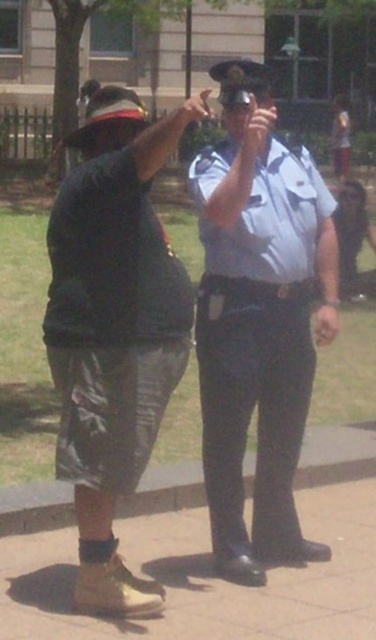
This screenshot has width=376, height=640. I want to click on matte black shirt at center, so click(x=113, y=328).

Can you confirm if matte black shirt at center is wider than matte black uniform at center?

Yes, matte black shirt at center is wider than matte black uniform at center.

Is point (98, 228) positioned in front of point (339, 227)?

Yes, it is in front of point (339, 227).

You are a GUI agent. You are given a task and a screenshot of the screen. Output one action in this format:
    pyautogui.click(x=<x>, y=<y>)
    Task: Click on the matte black shirt at center
    
    Given the screenshot: What is the action you would take?
    (113, 328)

Between white uniform shirt at center and brown leather shoe at lower left, which one appears on the left side from the viewer's perspective?

Positioned to the left is brown leather shoe at lower left.

Is white uniform shirt at center closer to the viewer compared to brown leather shoe at lower left?

No, it is not.

Locate an element on the screen. The height and width of the screenshot is (640, 376). white uniform shirt at center is located at coordinates (257, 321).

Who is positioned more to the left, brown leather shoe at lower left or matte black uniform at center?

brown leather shoe at lower left is more to the left.

Which is behind, point (54, 616) or point (363, 220)?

Point (363, 220)

I want to click on brown leather shoe at lower left, so click(x=206, y=579).